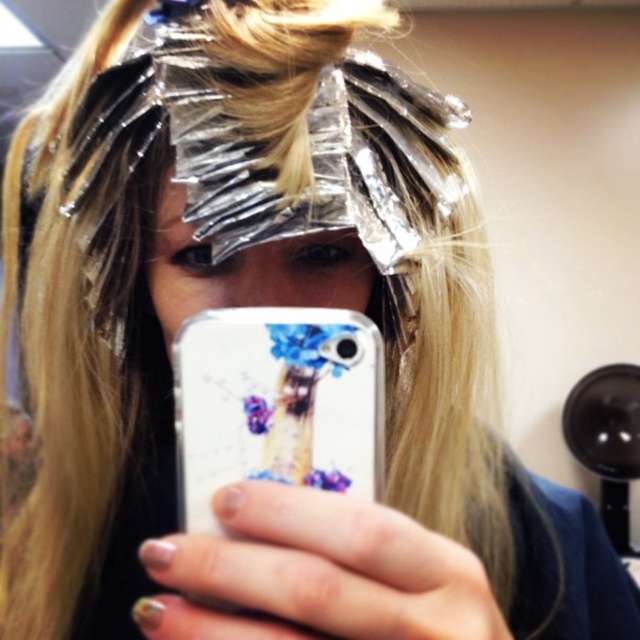
You are a photographer adjusting the focus on your camera. You notice two points in the frame at coordinates point (296, 385) and point (266, 260). Which point should you focus on to ensure the foreground element is sharp?

Point (296, 385) is closer to the camera than point (266, 260), so focusing on it will ensure the foreground element is sharp.

You are a photographer trying to capture a closeup of the aluminum foil strips on the person. The camera is at the point where the selfie is being taken. There is a point at coordinates point (228, 477) that is 10.15 inches away from the camera. Can you estimate whether the aluminum foil strips are closer to the camera than this point?

The distance between the point (228, 477) and the camera is 10.15 inches. Since the aluminum foil strips are part of the person undergoing hair coloring treatment and are likely positioned closer to the head, they might be at a similar or slightly different distance. However, without specific information about their exact position relative to the point, it is impossible to determine if they are closer than 10.15 inches. The answer cannot be definitively confirmed with the provided data.

You are a photographer trying to capture the best angle of the phone and its case in the image. Which object, the white glossy phone case at center or the matte plastic face at center, is positioned lower in the frame?

The white glossy phone case at center is positioned lower in the frame than the matte plastic face at center.